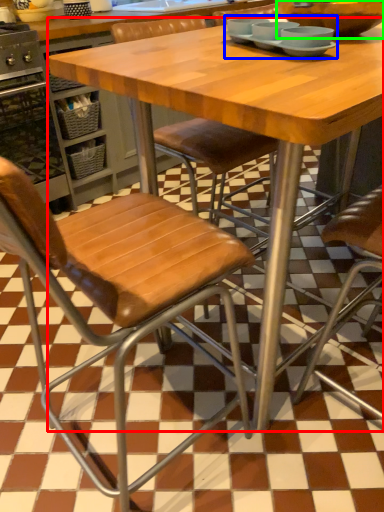
Question: Estimate the real-world distances between objects in this image. Which object is farther from table (highlighted by a red box), tableware (highlighted by a blue box) or bowl (highlighted by a green box)?

Choices:
 (A) tableware
 (B) bowl

Answer: (B)